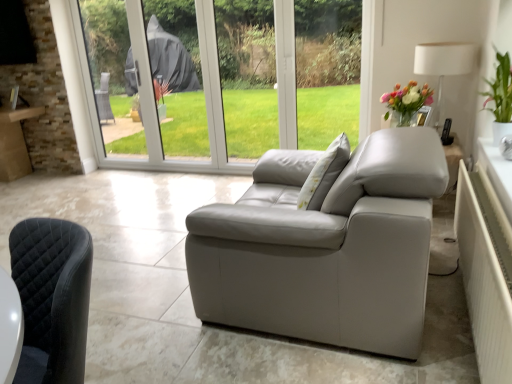
Question: Is white textured radiator at right oriented away from green leafy plant at upper right?

Choices:
 (A) no
 (B) yes

Answer: (A)

Question: From the image's perspective, is white textured radiator at right below green leafy plant at upper right?

Choices:
 (A) yes
 (B) no

Answer: (A)

Question: Is white textured radiator at right further to camera compared to green leafy plant at upper right?

Choices:
 (A) no
 (B) yes

Answer: (A)

Question: Is white textured radiator at right taller than green leafy plant at upper right?

Choices:
 (A) no
 (B) yes

Answer: (A)

Question: Can you confirm if white textured radiator at right is positioned to the right of green leafy plant at upper right?

Choices:
 (A) no
 (B) yes

Answer: (A)

Question: Considering the relative positions of white textured radiator at right and green leafy plant at upper right in the image provided, is white textured radiator at right in front of green leafy plant at upper right?

Choices:
 (A) yes
 (B) no

Answer: (A)

Question: Considering the relative positions of green leafy plant at upper right and white fabric lampshade at upper right in the image provided, is green leafy plant at upper right behind white fabric lampshade at upper right?

Choices:
 (A) no
 (B) yes

Answer: (A)

Question: Considering the relative sizes of green leafy plant at upper right and white fabric lampshade at upper right in the image provided, is green leafy plant at upper right taller than white fabric lampshade at upper right?

Choices:
 (A) no
 (B) yes

Answer: (A)

Question: Is white fabric lampshade at upper right a part of green leafy plant at upper right?

Choices:
 (A) yes
 (B) no

Answer: (B)

Question: Does green leafy plant at upper right appear on the right side of white fabric lampshade at upper right?

Choices:
 (A) no
 (B) yes

Answer: (B)

Question: Does green leafy plant at upper right have a lesser height compared to white fabric lampshade at upper right?

Choices:
 (A) yes
 (B) no

Answer: (A)

Question: Is green leafy plant at upper right positioned in front of white fabric lampshade at upper right?

Choices:
 (A) no
 (B) yes

Answer: (B)

Question: Is green leafy plant at upper right positioned with its back to white textured radiator at right?

Choices:
 (A) no
 (B) yes

Answer: (A)